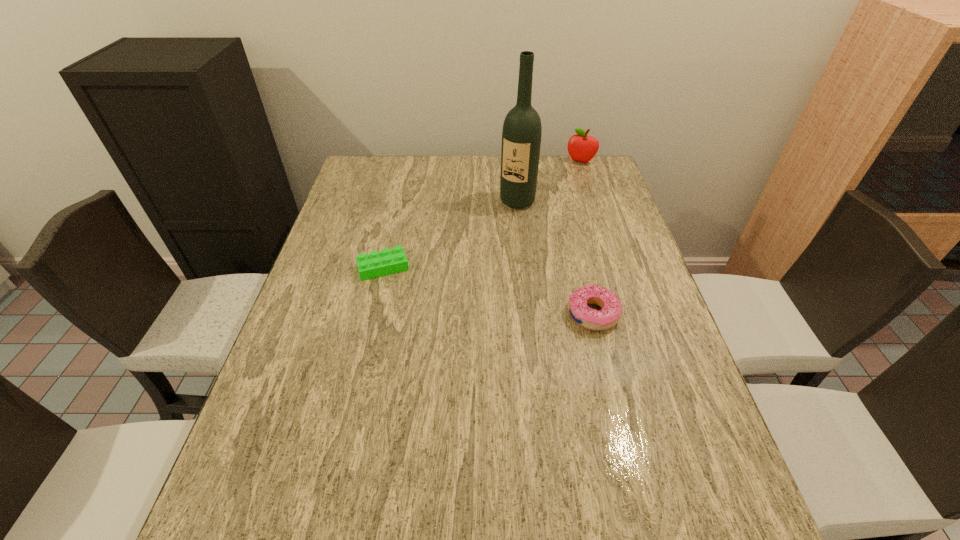
You are a GUI agent. You are given a task and a screenshot of the screen. Output one action in this format:
    pyautogui.click(x=<x>, y=<y>)
    Task: Click on the vacant space located 0.070m on the labeled side of the tallest object
    
    Given the screenshot: What is the action you would take?
    pyautogui.click(x=503, y=223)

Locate an element on the screen. This screenshot has height=540, width=960. vacant space situated 0.110m on the labeled side of the tallest object is located at coordinates (498, 231).

Find the location of a particular element. The height and width of the screenshot is (540, 960). vacant region located on the front-facing side of the second tallest object is located at coordinates (541, 225).

Where is `vacant space situated 0.270m on the front-facing side of the second tallest object`? This screenshot has height=540, width=960. vacant space situated 0.270m on the front-facing side of the second tallest object is located at coordinates (553, 206).

Identify the location of free space located 0.260m on the front-facing side of the second tallest object. This screenshot has width=960, height=540. (554, 204).

I want to click on wine bottle at the far edge, so click(x=521, y=136).

Find the location of a particular element. The image size is (960, 540). apple that is at the far edge is located at coordinates (582, 148).

Locate an element on the screen. The width and height of the screenshot is (960, 540). object at the left edge is located at coordinates (388, 261).

Locate an element on the screen. This screenshot has width=960, height=540. doughnut at the right edge is located at coordinates tap(610, 314).

At what (x,y) coordinates should I click in order to perform the action: click on apple positioned at the right edge. Please return your answer as a coordinate pair (x, y). Looking at the image, I should click on (582, 148).